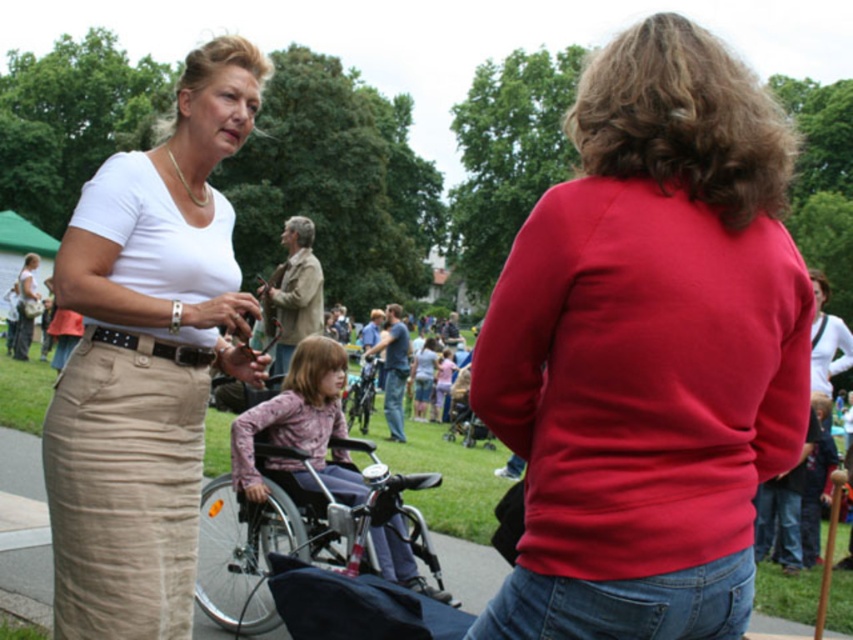
Question: Is matte red sweater at center wider than khaki cotton skirt at left?

Choices:
 (A) yes
 (B) no

Answer: (A)

Question: Which object is positioned farthest from the matte red sweater at center?

Choices:
 (A) pink fabric wheelchair at center
 (B) khaki cotton skirt at left

Answer: (A)

Question: Which of the following is the closest to the observer?

Choices:
 (A) khaki cotton skirt at left
 (B) matte red sweater at center

Answer: (B)

Question: Which object is the closest to the pink fabric wheelchair at center?

Choices:
 (A) matte red sweater at center
 (B) metallic silver wheelchair at center

Answer: (B)

Question: Can you confirm if metallic silver wheelchair at center is positioned to the right of pink fabric wheelchair at center?

Choices:
 (A) no
 (B) yes

Answer: (A)

Question: Can you confirm if matte red sweater at center is positioned above pink fabric wheelchair at center?

Choices:
 (A) no
 (B) yes

Answer: (B)